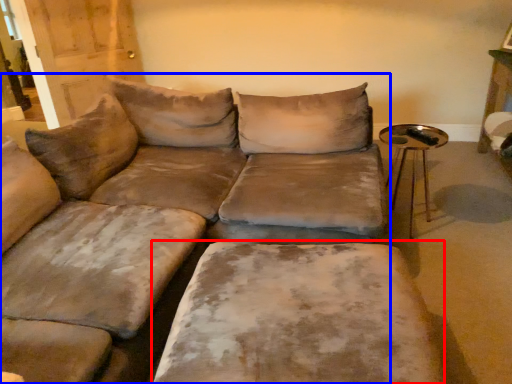
Question: Which object appears farthest to the camera in this image, wide (highlighted by a red box) or studio couch (highlighted by a blue box)?

Choices:
 (A) wide
 (B) studio couch

Answer: (A)